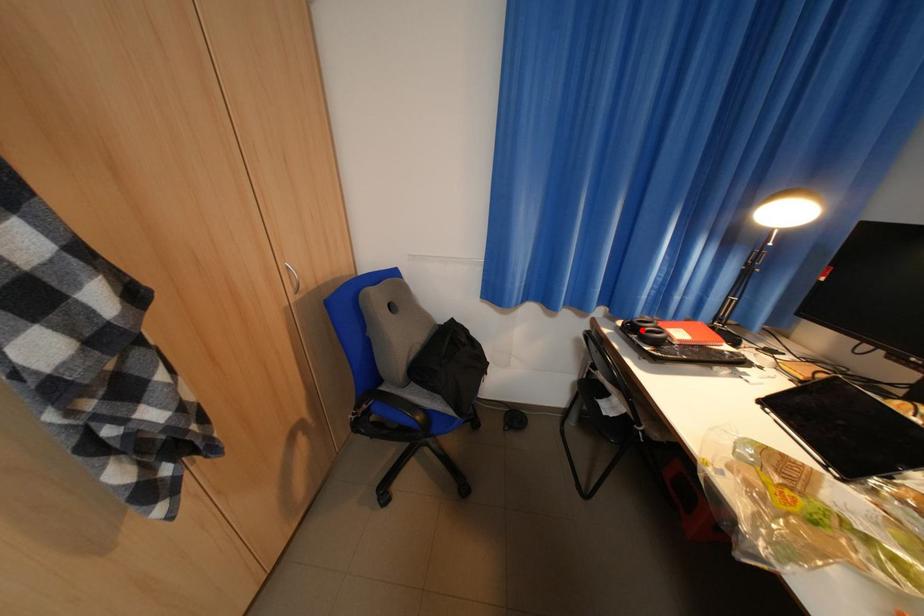
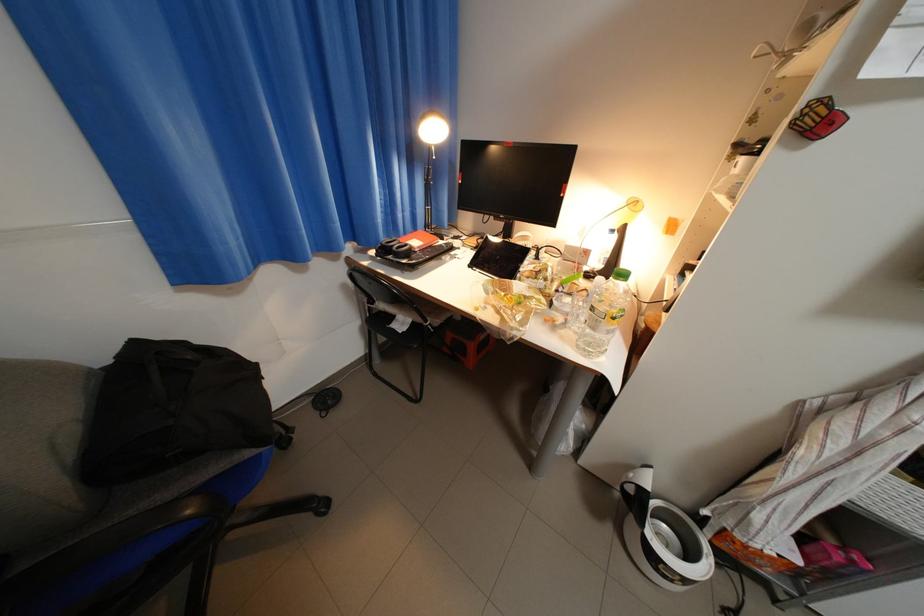
Find the pixel in the second image that matches the highlighted location in the first image.

(395, 253)